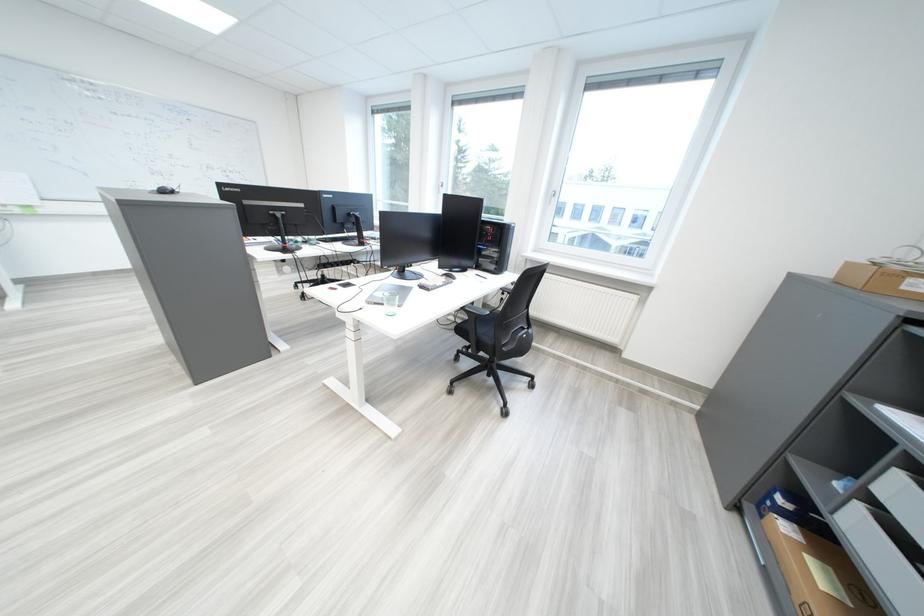
You are a GUI agent. You are given a task and a screenshot of the screen. Output one action in this format:
    pyautogui.click(x=<x>, y=<y>)
    Task: Click on the white window handle
    This screenshot has width=924, height=616.
    Given the screenshot: What is the action you would take?
    pyautogui.click(x=553, y=198)